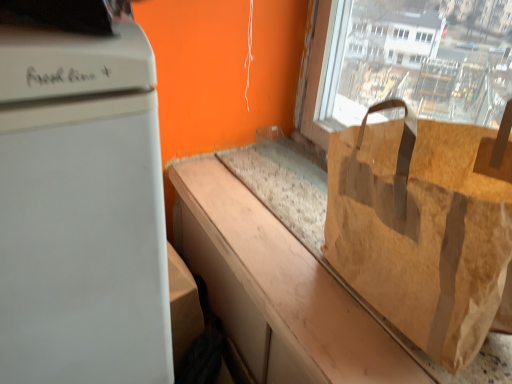
Question: Is white matte refrigerator at left further to camera compared to brown paper bag at center?

Choices:
 (A) no
 (B) yes

Answer: (A)

Question: Would you say white matte refrigerator at left contains brown paper bag at center?

Choices:
 (A) yes
 (B) no

Answer: (B)

Question: From the image's perspective, is white matte refrigerator at left on brown paper bag at center?

Choices:
 (A) yes
 (B) no

Answer: (B)

Question: Does white matte refrigerator at left have a greater width compared to brown paper bag at center?

Choices:
 (A) no
 (B) yes

Answer: (B)

Question: From a real-world perspective, is white matte refrigerator at left on top of brown paper bag at center?

Choices:
 (A) yes
 (B) no

Answer: (B)

Question: Considering the relative sizes of white matte refrigerator at left and brown paper bag at center in the image provided, is white matte refrigerator at left taller than brown paper bag at center?

Choices:
 (A) yes
 (B) no

Answer: (A)

Question: Does brown paper bag at right have a greater height compared to white matte refrigerator at left?

Choices:
 (A) no
 (B) yes

Answer: (A)

Question: Is brown paper bag at right positioned far away from white matte refrigerator at left?

Choices:
 (A) no
 (B) yes

Answer: (A)

Question: From a real-world perspective, is brown paper bag at right located higher than white matte refrigerator at left?

Choices:
 (A) yes
 (B) no

Answer: (A)

Question: Is brown paper bag at right placed right next to white matte refrigerator at left?

Choices:
 (A) no
 (B) yes

Answer: (A)

Question: Is brown paper bag at right shorter than white matte refrigerator at left?

Choices:
 (A) no
 (B) yes

Answer: (B)

Question: From the image's perspective, is brown paper bag at right under white matte refrigerator at left?

Choices:
 (A) yes
 (B) no

Answer: (B)

Question: Considering the relative sizes of white matte refrigerator at left and brown paper bag at right in the image provided, is white matte refrigerator at left taller than brown paper bag at right?

Choices:
 (A) no
 (B) yes

Answer: (B)